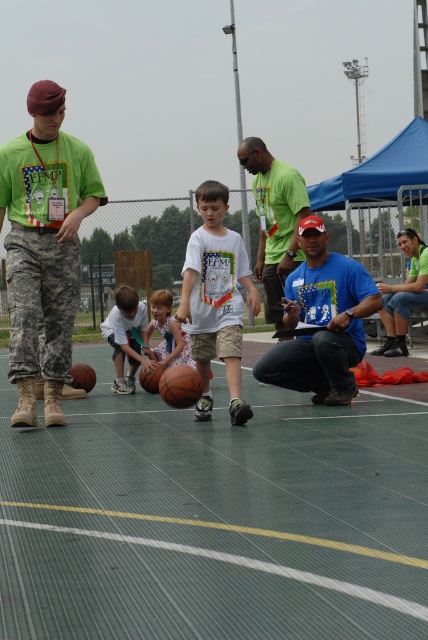
Question: Which object is positioned closest to the blue t-shirt at center?

Choices:
 (A) camouflage pants at left
 (B) floral dress at center
 (C) green rubber court at center

Answer: (B)

Question: Can you confirm if white matte t-shirt at center is bigger than green matte shirt at center?

Choices:
 (A) yes
 (B) no

Answer: (B)

Question: Which point is farther from the camera taking this photo?

Choices:
 (A) (8, 374)
 (B) (353, 588)
 (C) (130, 301)
 (D) (186, 387)

Answer: (C)

Question: Is camouflage pants at left positioned behind white cotton shirt at center?

Choices:
 (A) yes
 (B) no

Answer: (B)

Question: Which point is farther to the camera?

Choices:
 (A) white cotton shirt at center
 (B) camouflage pants at left

Answer: (A)

Question: Is matte orange basketball at center to the left of white matte t-shirt at center from the viewer's perspective?

Choices:
 (A) yes
 (B) no

Answer: (A)